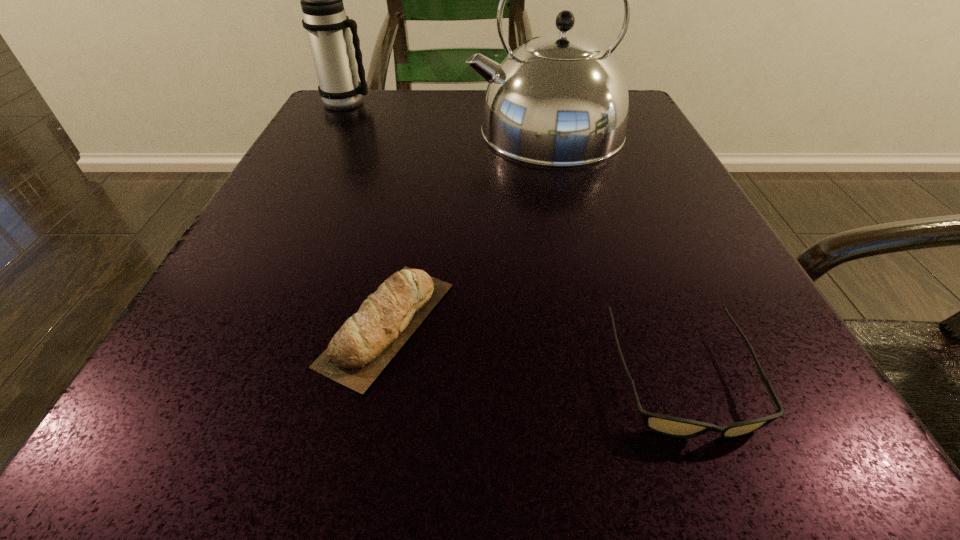
Find the location of a particular element. The image size is (960, 540). vacant area in the image that satisfies the following two spatial constraints: 1. on the side with the handle of the third object from right to left; 2. on the right side of the third shortest object is located at coordinates (229, 323).